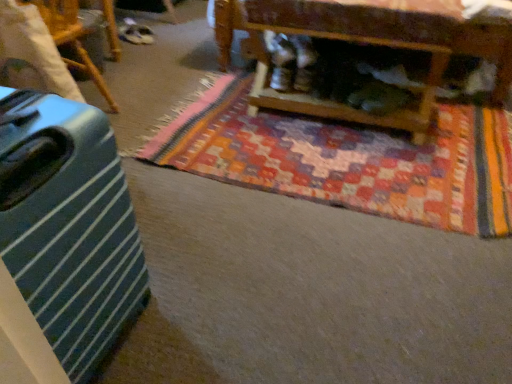
Question: Looking at the image, does multicolored woven mat at center seem bigger or smaller compared to green striped suitcase at left, arranged as the second furniture when viewed from the right?

Choices:
 (A) small
 (B) big

Answer: (B)

Question: Is multicolored woven mat at center wider or thinner than green striped suitcase at left, which appears as the first furniture when viewed from the left?

Choices:
 (A) wide
 (B) thin

Answer: (A)

Question: Which is nearer to the green striped suitcase at left, arranged as the second furniture when viewed from the right?

Choices:
 (A) green striped suitcase at left
 (B) wooden coffee table at upper center, the 2th furniture when ordered from left to right
 (C) multicolored woven mat at center

Answer: (C)

Question: Considering the real-world distances, which object is farthest from the wooden coffee table at upper center, the first furniture when ordered from right to left?

Choices:
 (A) multicolored woven mat at center
 (B) green striped suitcase at left
 (C) green striped suitcase at left, which appears as the first furniture when viewed from the left

Answer: (B)